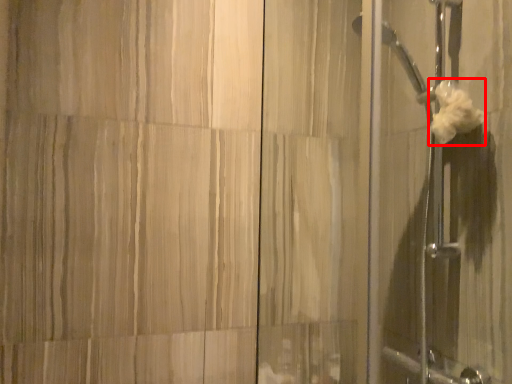
Question: Where is flower (annotated by the red box) located in relation to screen door in the image?

Choices:
 (A) right
 (B) left

Answer: (A)